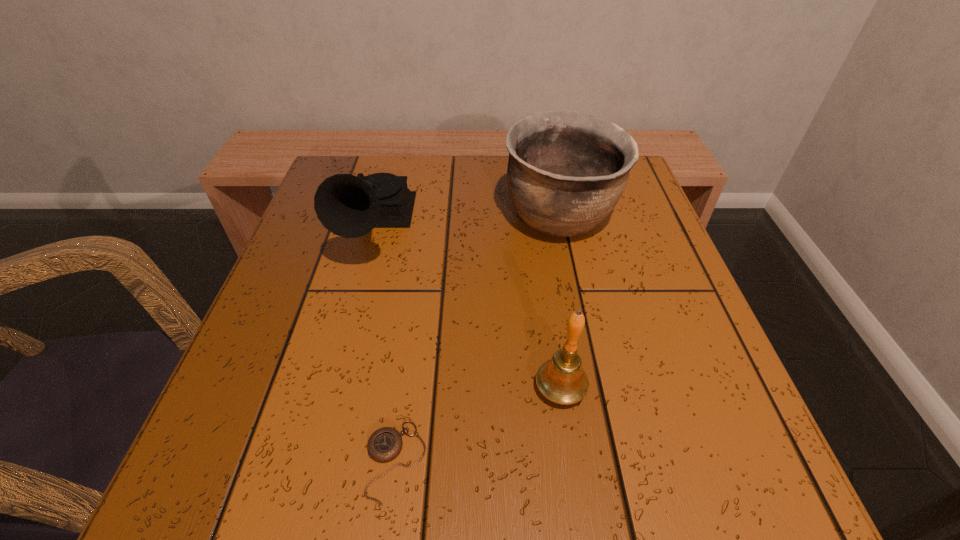
Where is `pottery that is at the far edge`? This screenshot has width=960, height=540. pottery that is at the far edge is located at coordinates (567, 170).

Where is `object present at the near edge`? The image size is (960, 540). object present at the near edge is located at coordinates (385, 444).

Find the location of a particular element. This screenshot has width=960, height=540. object that is at the left edge is located at coordinates (349, 206).

This screenshot has height=540, width=960. In order to click on object that is at the right edge in this screenshot , I will do `click(567, 170)`.

Locate an element on the screen. object located in the far left corner section of the desktop is located at coordinates (349, 206).

Locate an element on the screen. object that is at the far right corner is located at coordinates (567, 170).

The image size is (960, 540). What are the coordinates of `free point at the far edge` in the screenshot? It's located at (485, 173).

In the image, there is a desktop. Where is `vacant space at the left edge`? The height and width of the screenshot is (540, 960). vacant space at the left edge is located at coordinates (338, 351).

Where is `vacant space at the right edge of the desktop`? The height and width of the screenshot is (540, 960). vacant space at the right edge of the desktop is located at coordinates (624, 226).

Find the location of a particular element. The image size is (960, 540). blank region between the pocket watch and the bell is located at coordinates (478, 425).